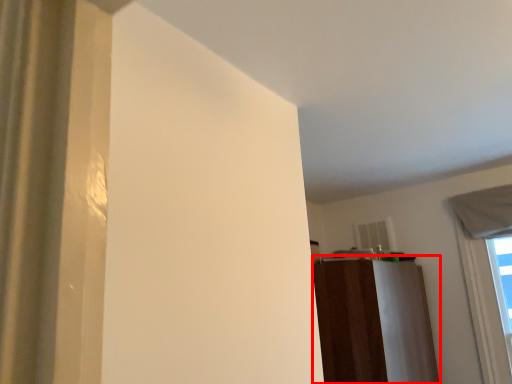
Question: From the image's perspective, where is dresser (annotated by the red box) located relative to window?

Choices:
 (A) below
 (B) above

Answer: (A)